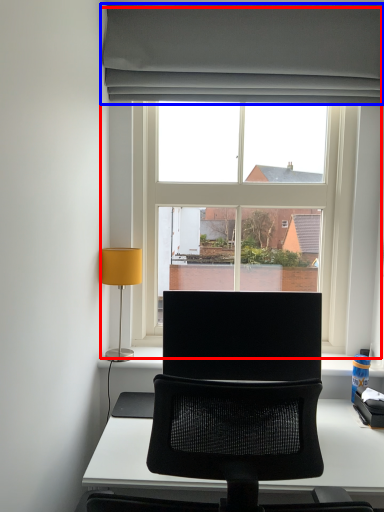
Question: Which point is further to the camera, window (highlighted by a red box) or curtain (highlighted by a blue box)?

Choices:
 (A) window
 (B) curtain

Answer: (A)